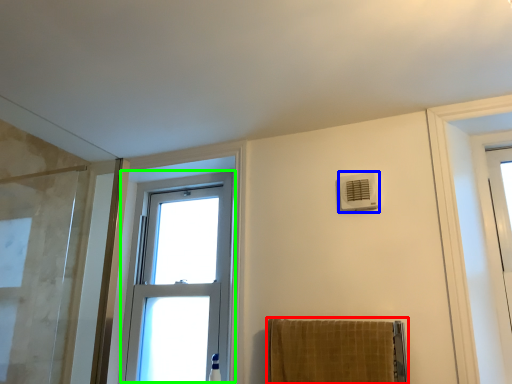
Question: Which object is the closest to the towel (highlighted by a red box)? Choose among these: air conditioning (highlighted by a blue box) or window (highlighted by a green box).

Choices:
 (A) air conditioning
 (B) window

Answer: (A)